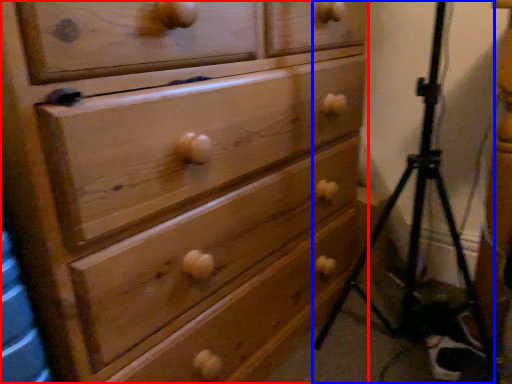
Question: Which of the following is the farthest to the observer, chest of drawers (highlighted by a red box) or tripod (highlighted by a blue box)?

Choices:
 (A) chest of drawers
 (B) tripod

Answer: (B)